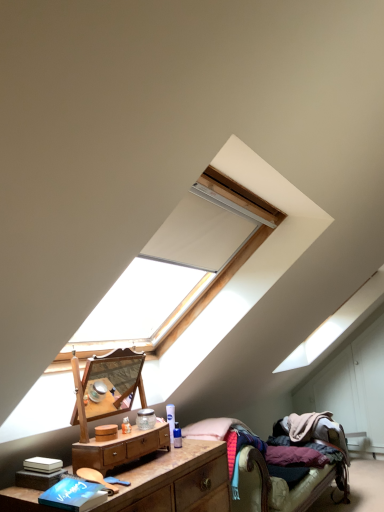
In order to face wooden nightstand at lower left, the second nightstand viewed from the top, should I rotate leftwards or rightwards?

To align with it, rotate left about 8.424°.

The image size is (384, 512). What do you see at coordinates (176, 481) in the screenshot?
I see `wooden nightstand at lower left, the second nightstand viewed from the top` at bounding box center [176, 481].

This screenshot has height=512, width=384. Describe the element at coordinates (278, 488) in the screenshot. I see `textured fabric bed at lower right` at that location.

This screenshot has height=512, width=384. In order to click on blue matte book at lower left in this screenshot , I will do coord(74,494).

There is a textured fabric bed at lower right. At what (x,y) coordinates should I click in order to perform the action: click on the 2nd nightstand above it (from the image's perspective). Please return your answer as a coordinate pair (x, y). Looking at the image, I should click on (120, 448).

Which object is further away from the camera, wooden polished nightstand at center, the first nightstand in the top-to-bottom sequence, or textured fabric bed at lower right?

textured fabric bed at lower right is behind.

Consider the image. From a real-world perspective, is wooden polished nightstand at center, the first nightstand in the top-to-bottom sequence, physically located above or below textured fabric bed at lower right?

Clearly, from a real-world perspective, wooden polished nightstand at center, the first nightstand in the top-to-bottom sequence, is above textured fabric bed at lower right.

Is textured fabric bed at lower right looking in the opposite direction of wooden nightstand at lower left, the second nightstand viewed from the top?

textured fabric bed at lower right does not have its back to wooden nightstand at lower left, the second nightstand viewed from the top.

The image size is (384, 512). Find the location of `bed to the right of wooden nightstand at lower left, the second nightstand viewed from the top`. bed to the right of wooden nightstand at lower left, the second nightstand viewed from the top is located at coordinates (278, 488).

Is textured fabric bed at lower right not close to wooden nightstand at lower left, placed as the first nightstand when sorted from bottom to top?

Actually, textured fabric bed at lower right and wooden nightstand at lower left, placed as the first nightstand when sorted from bottom to top, are a little close together.

From the image's perspective, is textured fabric bed at lower right above or below wooden nightstand at lower left, the second nightstand viewed from the top?

From the image's perspective, textured fabric bed at lower right appears below wooden nightstand at lower left, the second nightstand viewed from the top.

Which is more to the right, wooden polished nightstand at center, the first nightstand in the top-to-bottom sequence, or wooden nightstand at lower left, the second nightstand viewed from the top?

Positioned to the right is wooden nightstand at lower left, the second nightstand viewed from the top.

Is wooden polished nightstand at center, the first nightstand in the top-to-bottom sequence, with wooden nightstand at lower left, placed as the first nightstand when sorted from bottom to top?

There is a gap between wooden polished nightstand at center, the first nightstand in the top-to-bottom sequence, and wooden nightstand at lower left, placed as the first nightstand when sorted from bottom to top.

In the scene shown: Which point is more distant from viewer, (x=163, y=430) or (x=140, y=467)?

The point (x=163, y=430) is farther from the camera.

Is wooden nightstand at lower left, placed as the first nightstand when sorted from bottom to top, oriented towards textured fabric bed at lower right?

No, wooden nightstand at lower left, placed as the first nightstand when sorted from bottom to top, is not turned towards textured fabric bed at lower right.

From a real-world perspective, who is located higher, wooden nightstand at lower left, the second nightstand viewed from the top, or textured fabric bed at lower right?

In real-world perspective, wooden nightstand at lower left, the second nightstand viewed from the top, is above.

Does point (176, 454) lie in front of point (343, 472)?

That is True.

Relative to textured fabric bed at lower right, is wooden nightstand at lower left, placed as the first nightstand when sorted from bottom to top, in front or behind?

Clearly, wooden nightstand at lower left, placed as the first nightstand when sorted from bottom to top, is in front of textured fabric bed at lower right.

From a real-world perspective, which is physically above, blue matte book at lower left or wooden nightstand at lower left, placed as the first nightstand when sorted from bottom to top?

From a 3D spatial view, blue matte book at lower left is above.

From the image's perspective, between blue matte book at lower left and wooden nightstand at lower left, placed as the first nightstand when sorted from bottom to top, which one is located above?

blue matte book at lower left appears higher in the image.

Based on the photo, is the depth of blue matte book at lower left greater than that of wooden nightstand at lower left, placed as the first nightstand when sorted from bottom to top?

Yes, it is behind wooden nightstand at lower left, placed as the first nightstand when sorted from bottom to top.

Considering the relative positions of blue matte book at lower left and textured fabric bed at lower right in the image provided, is blue matte book at lower left to the left of textured fabric bed at lower right from the viewer's perspective?

Yes.

From a real-world perspective, relative to textured fabric bed at lower right, is blue matte book at lower left vertically above or below?

From a real-world perspective, blue matte book at lower left is physically above textured fabric bed at lower right.

How different are the orientations of blue matte book at lower left and textured fabric bed at lower right in degrees?

There is a 0.0015-degree angle between the facing directions of blue matte book at lower left and textured fabric bed at lower right.

Considering the relative sizes of blue matte book at lower left and textured fabric bed at lower right in the image provided, is blue matte book at lower left thinner than textured fabric bed at lower right?

Yes.

The width and height of the screenshot is (384, 512). Find the location of `nightstand behind the wooden nightstand at lower left, placed as the first nightstand when sorted from bottom to top`. nightstand behind the wooden nightstand at lower left, placed as the first nightstand when sorted from bottom to top is located at coordinates (120, 448).

Considering the relative positions of wooden nightstand at lower left, placed as the first nightstand when sorted from bottom to top, and wooden polished nightstand at center, the 2th nightstand ordered from the bottom, in the image provided, is wooden nightstand at lower left, placed as the first nightstand when sorted from bottom to top, behind wooden polished nightstand at center, the 2th nightstand ordered from the bottom,?

No, wooden nightstand at lower left, placed as the first nightstand when sorted from bottom to top, is closer to the camera.

Which of these two, wooden nightstand at lower left, the second nightstand viewed from the top, or wooden polished nightstand at center, the 2th nightstand ordered from the bottom, stands taller?

Standing taller between the two is wooden nightstand at lower left, the second nightstand viewed from the top.

Is wooden nightstand at lower left, the second nightstand viewed from the top, aimed at wooden polished nightstand at center, the first nightstand in the top-to-bottom sequence?

No, wooden nightstand at lower left, the second nightstand viewed from the top, is not turned towards wooden polished nightstand at center, the first nightstand in the top-to-bottom sequence.

This screenshot has width=384, height=512. I want to click on bed below the wooden polished nightstand at center, the first nightstand in the top-to-bottom sequence (from the image's perspective), so click(278, 488).

Locate an element on the screen. the 1st nightstand above the textured fabric bed at lower right (from a real-world perspective) is located at coordinates coord(176,481).

Which object lies further to the anchor point wooden nightstand at lower left, the second nightstand viewed from the top, blue matte book at lower left or wooden polished nightstand at center, the first nightstand in the top-to-bottom sequence?

Based on the image, blue matte book at lower left appears to be further to wooden nightstand at lower left, the second nightstand viewed from the top.

Which object lies further to the anchor point blue matte book at lower left, wooden polished nightstand at center, the 2th nightstand ordered from the bottom, or textured fabric bed at lower right?

Among the two, textured fabric bed at lower right is located further to blue matte book at lower left.

In the scene shown: Estimate the real-world distances between objects in this image. Which object is further from wooden nightstand at lower left, placed as the first nightstand when sorted from bottom to top, wooden polished nightstand at center, the first nightstand in the top-to-bottom sequence, or textured fabric bed at lower right?

textured fabric bed at lower right lies further to wooden nightstand at lower left, placed as the first nightstand when sorted from bottom to top, than the other object.

Based on their spatial positions, is wooden polished nightstand at center, the first nightstand in the top-to-bottom sequence, or wooden nightstand at lower left, the second nightstand viewed from the top, closer to textured fabric bed at lower right?

Based on the image, wooden nightstand at lower left, the second nightstand viewed from the top, appears to be nearer to textured fabric bed at lower right.

Considering their positions, is wooden nightstand at lower left, placed as the first nightstand when sorted from bottom to top, positioned closer to wooden polished nightstand at center, the first nightstand in the top-to-bottom sequence, than blue matte book at lower left?

wooden nightstand at lower left, placed as the first nightstand when sorted from bottom to top, is positioned closer to the anchor wooden polished nightstand at center, the first nightstand in the top-to-bottom sequence.

Considering their positions, is blue matte book at lower left positioned closer to textured fabric bed at lower right than wooden polished nightstand at center, the 2th nightstand ordered from the bottom?

Among the two, wooden polished nightstand at center, the 2th nightstand ordered from the bottom, is located nearer to textured fabric bed at lower right.

When comparing their distances from wooden nightstand at lower left, the second nightstand viewed from the top, does textured fabric bed at lower right or wooden polished nightstand at center, the 2th nightstand ordered from the bottom, seem further?

Among the two, textured fabric bed at lower right is located further to wooden nightstand at lower left, the second nightstand viewed from the top.

From the image, which object appears to be farther from textured fabric bed at lower right, wooden nightstand at lower left, placed as the first nightstand when sorted from bottom to top, or wooden polished nightstand at center, the 2th nightstand ordered from the bottom?

wooden polished nightstand at center, the 2th nightstand ordered from the bottom.

The width and height of the screenshot is (384, 512). I want to click on nightstand situated between wooden polished nightstand at center, the 2th nightstand ordered from the bottom, and textured fabric bed at lower right from left to right, so click(176, 481).

Where is `book between wooden nightstand at lower left, placed as the first nightstand when sorted from bottom to top, and wooden polished nightstand at center, the first nightstand in the top-to-bottom sequence, from front to back`? This screenshot has width=384, height=512. book between wooden nightstand at lower left, placed as the first nightstand when sorted from bottom to top, and wooden polished nightstand at center, the first nightstand in the top-to-bottom sequence, from front to back is located at coordinates (74, 494).